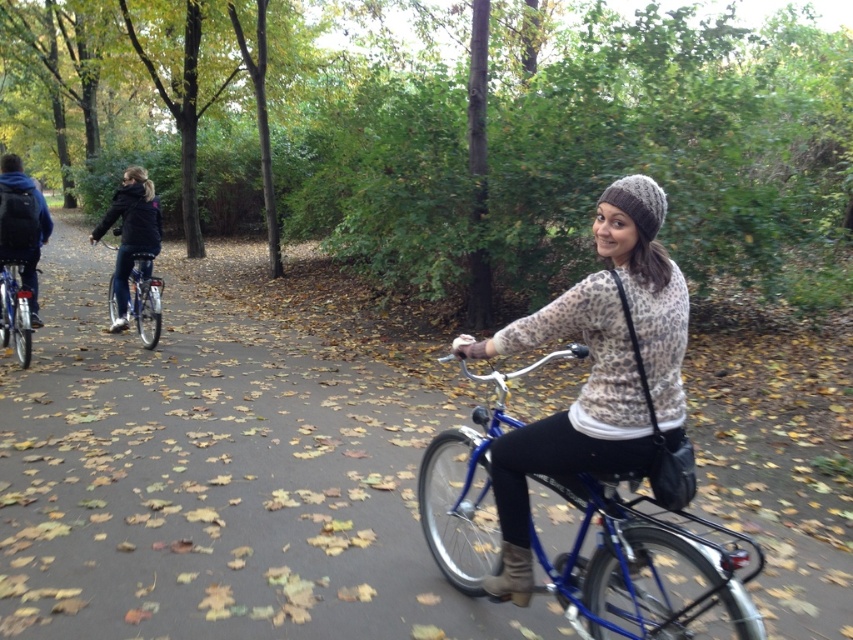
Is point (28, 241) closer to viewer compared to point (15, 289)?

No.

Measure the distance from blue backpack at left to shiny metallic bicycle at left.

24.71 centimeters

Locate an element on the screen. blue backpack at left is located at coordinates (22, 225).

This screenshot has width=853, height=640. I want to click on blue backpack at left, so click(x=22, y=225).

Locate an element on the screen. leopard print sweater at center is located at coordinates coord(566,417).

Is point (642, 212) in front of point (10, 188)?

Yes.

Image resolution: width=853 pixels, height=640 pixels. Find the location of `leopard print sweater at center`. leopard print sweater at center is located at coordinates (566, 417).

Between blue metallic bicycle at center and shiny silver bicycle at left, which one appears on the left side from the viewer's perspective?

shiny silver bicycle at left

Is blue metallic bicycle at center positioned behind shiny silver bicycle at left?

No, it is in front of shiny silver bicycle at left.

You are a GUI agent. You are given a task and a screenshot of the screen. Output one action in this format:
    pyautogui.click(x=<x>, y=<y>)
    Task: Click on the blue metallic bicycle at center
    
    Given the screenshot: What is the action you would take?
    pyautogui.click(x=637, y=566)